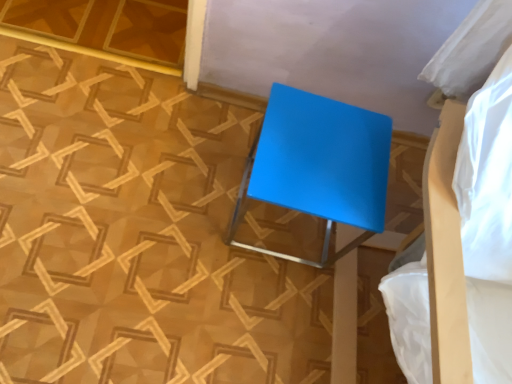
Question: Should I look upward or downward to see blue glossy stool at center?

Choices:
 (A) up
 (B) down

Answer: (A)

Question: Is matte blue bed at upper right further to the viewer compared to blue glossy stool at center?

Choices:
 (A) no
 (B) yes

Answer: (A)

Question: Is matte blue bed at upper right far away from blue glossy stool at center?

Choices:
 (A) yes
 (B) no

Answer: (B)

Question: Is matte blue bed at upper right thinner than blue glossy stool at center?

Choices:
 (A) no
 (B) yes

Answer: (A)

Question: From the image's perspective, is matte blue bed at upper right above blue glossy stool at center?

Choices:
 (A) no
 (B) yes

Answer: (A)

Question: Is matte blue bed at upper right smaller than blue glossy stool at center?

Choices:
 (A) yes
 (B) no

Answer: (B)

Question: Considering the relative sizes of matte blue bed at upper right and blue glossy stool at center in the image provided, is matte blue bed at upper right bigger than blue glossy stool at center?

Choices:
 (A) no
 (B) yes

Answer: (B)

Question: Can you confirm if blue glossy stool at center is positioned to the right of matte blue bed at upper right?

Choices:
 (A) yes
 (B) no

Answer: (B)

Question: Is the position of blue glossy stool at center more distant than that of matte blue bed at upper right?

Choices:
 (A) no
 (B) yes

Answer: (B)

Question: Is blue glossy stool at center not within matte blue bed at upper right?

Choices:
 (A) yes
 (B) no

Answer: (A)

Question: Does blue glossy stool at center have a lesser width compared to matte blue bed at upper right?

Choices:
 (A) yes
 (B) no

Answer: (A)

Question: Considering the relative sizes of blue glossy stool at center and matte blue bed at upper right in the image provided, is blue glossy stool at center wider than matte blue bed at upper right?

Choices:
 (A) no
 (B) yes

Answer: (A)

Question: Would you say matte blue bed at upper right is part of blue glossy stool at center's contents?

Choices:
 (A) no
 (B) yes

Answer: (A)

Question: Is point (390, 302) positioned closer to the camera than point (352, 193)?

Choices:
 (A) farther
 (B) closer

Answer: (A)